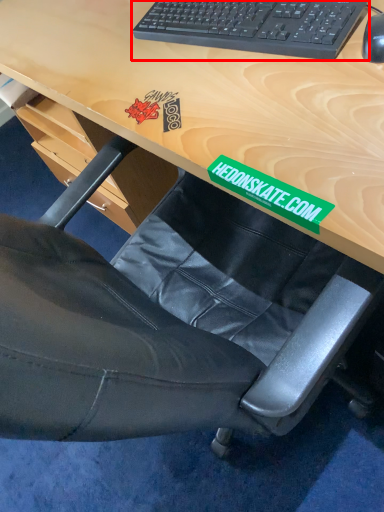
Question: In this image, where is computer keyboard (annotated by the red box) located relative to mouse?

Choices:
 (A) left
 (B) right

Answer: (A)